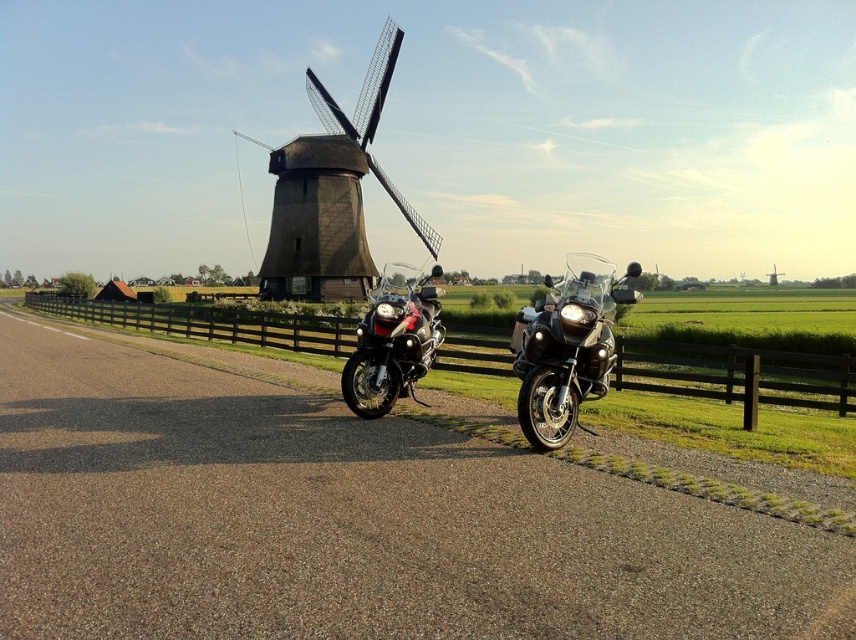
Can you confirm if brown wooden fence at lower center is positioned to the right of matte black motorcycle at center?

No, brown wooden fence at lower center is not to the right of matte black motorcycle at center.

This screenshot has width=856, height=640. What do you see at coordinates (735, 374) in the screenshot?
I see `brown wooden fence at lower center` at bounding box center [735, 374].

At what (x,y) coordinates should I click in order to perform the action: click on brown wooden fence at lower center. Please return your answer as a coordinate pair (x, y). Image resolution: width=856 pixels, height=640 pixels. Looking at the image, I should click on (735, 374).

Can you confirm if brown wooden fence at lower center is smaller than glossy black motorcycle at center?

Actually, brown wooden fence at lower center might be larger than glossy black motorcycle at center.

Is brown wooden fence at lower center below glossy black motorcycle at center?

No.

Image resolution: width=856 pixels, height=640 pixels. Find the location of `brown wooden fence at lower center`. brown wooden fence at lower center is located at coordinates (735, 374).

Based on the photo, is brown wooden fence at lower center shorter than brown wooden windmill at upper center?

Indeed, brown wooden fence at lower center has a lesser height compared to brown wooden windmill at upper center.

Does point (827, 388) come closer to viewer compared to point (375, 272)?

Yes, point (827, 388) is in front of point (375, 272).

Where is `brown wooden fence at lower center`? brown wooden fence at lower center is located at coordinates (735, 374).